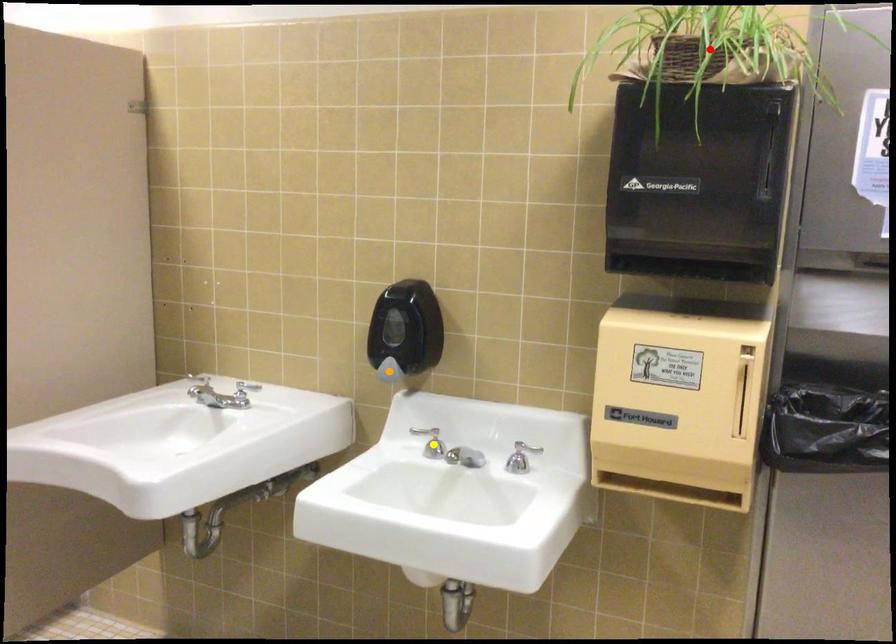
Order these from farthest to nearest:
red point | orange point | yellow point

yellow point
orange point
red point